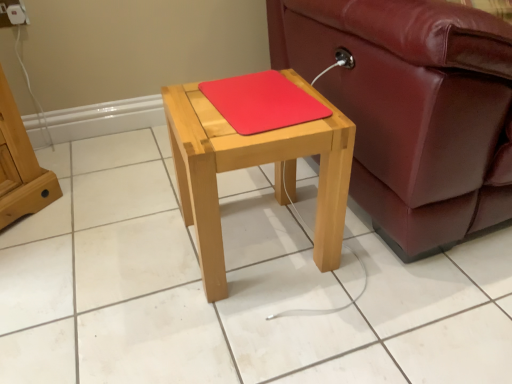
Question: Is natural wood table at center to the left of white plastic electric outlet at upper left from the viewer's perspective?

Choices:
 (A) yes
 (B) no

Answer: (B)

Question: From the image's perspective, does natural wood table at center appear lower than white plastic electric outlet at upper left?

Choices:
 (A) no
 (B) yes

Answer: (B)

Question: Does natural wood table at center have a smaller size compared to white plastic electric outlet at upper left?

Choices:
 (A) no
 (B) yes

Answer: (A)

Question: Can you confirm if natural wood table at center is thinner than white plastic electric outlet at upper left?

Choices:
 (A) yes
 (B) no

Answer: (B)

Question: From the image's perspective, would you say natural wood table at center is positioned over white plastic electric outlet at upper left?

Choices:
 (A) no
 (B) yes

Answer: (A)

Question: Is natural wood table at center next to white plastic electric outlet at upper left?

Choices:
 (A) yes
 (B) no

Answer: (B)

Question: Is white plastic electric outlet at upper left oriented towards rubberized red mousepad at center?

Choices:
 (A) no
 (B) yes

Answer: (A)

Question: Is rubberized red mousepad at center surrounded by white plastic electric outlet at upper left?

Choices:
 (A) no
 (B) yes

Answer: (A)

Question: Does white plastic electric outlet at upper left have a lesser height compared to rubberized red mousepad at center?

Choices:
 (A) yes
 (B) no

Answer: (B)

Question: Does white plastic electric outlet at upper left appear on the right side of rubberized red mousepad at center?

Choices:
 (A) no
 (B) yes

Answer: (A)

Question: Are white plastic electric outlet at upper left and rubberized red mousepad at center located far from each other?

Choices:
 (A) yes
 (B) no

Answer: (B)

Question: Does white plastic electric outlet at upper left have a greater width compared to rubberized red mousepad at center?

Choices:
 (A) no
 (B) yes

Answer: (A)

Question: From a real-world perspective, is white plastic electric outlet at upper left under natural wood table at center?

Choices:
 (A) no
 (B) yes

Answer: (A)